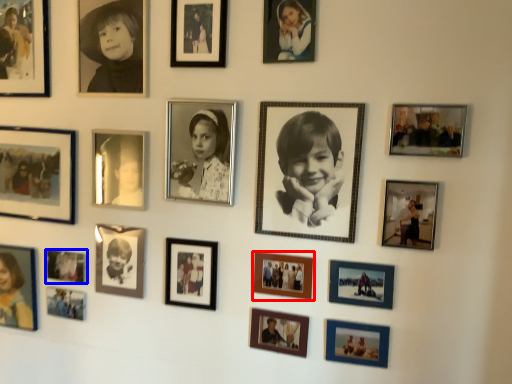
Question: Which of the following is the closest to the observer, picture frame (highlighted by a red box) or picture frame (highlighted by a blue box)?

Choices:
 (A) picture frame
 (B) picture frame

Answer: (A)